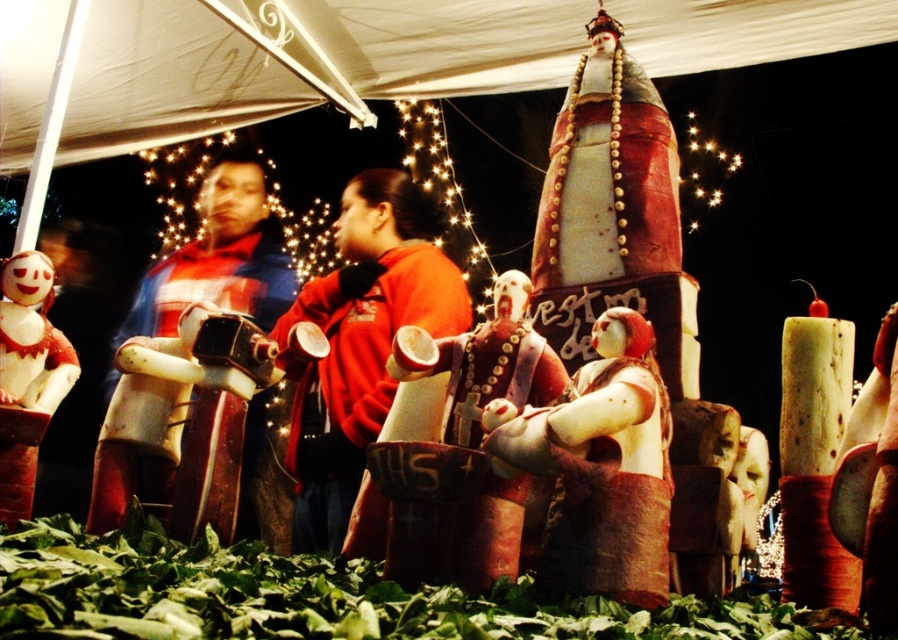
You are a guest at this festive event and want to take a photo of both the red matte jacket at center and the illuminated glass ornament at upper center. Which object should you focus on first to ensure both are in the frame?

You should focus on the illuminated glass ornament at upper center first since it is above the red matte jacket at center, so by centering your camera on the ornament, you can adjust the framing to include both objects.